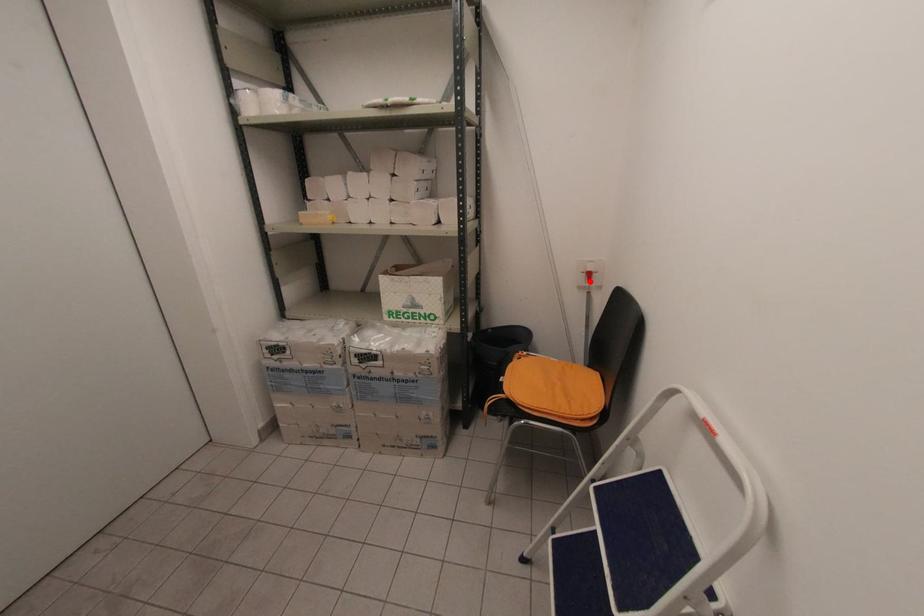
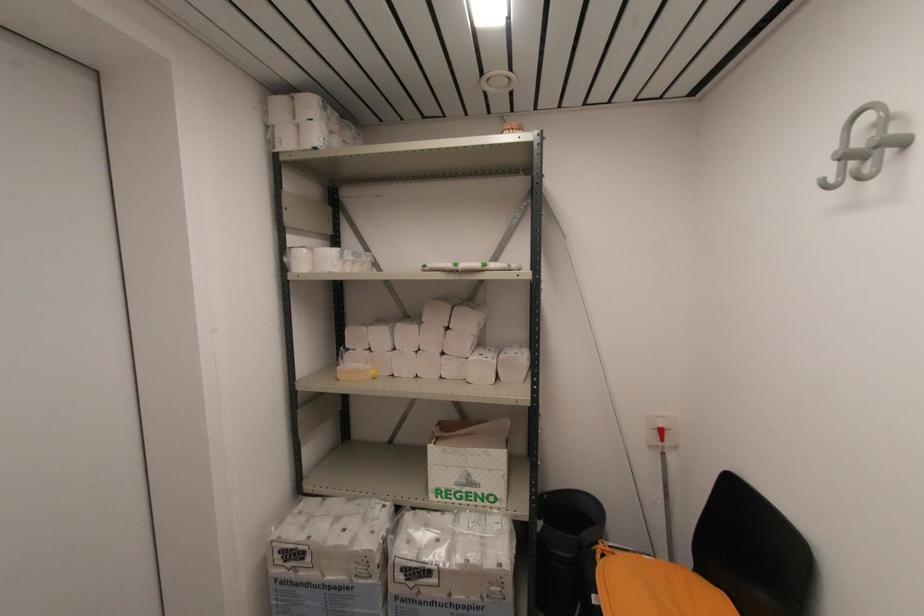
Where in the second image is the point corresponding to the highlighted location from the first image?

(663, 439)